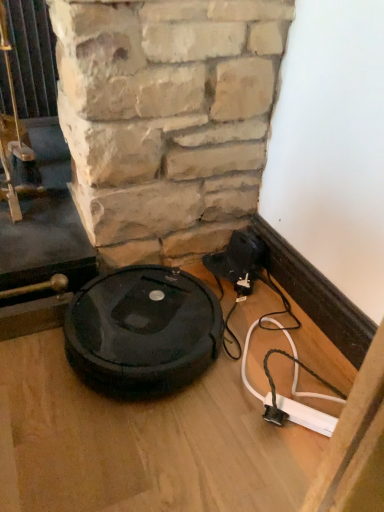
What do you see at coordinates (142, 331) in the screenshot? The height and width of the screenshot is (512, 384). I see `black plastic robot vacuum cleaner at lower left` at bounding box center [142, 331].

Find the location of `black plastic robot vacuum cleaner at lower left`. black plastic robot vacuum cleaner at lower left is located at coordinates (142, 331).

In order to face black plastic robot vacuum cleaner at lower left, should I rotate leftwards or rightwards?

Turn left approximately 6.832 degrees to face it.

Locate an element on the screen. This screenshot has height=512, width=384. black plastic robot vacuum cleaner at lower left is located at coordinates (142, 331).